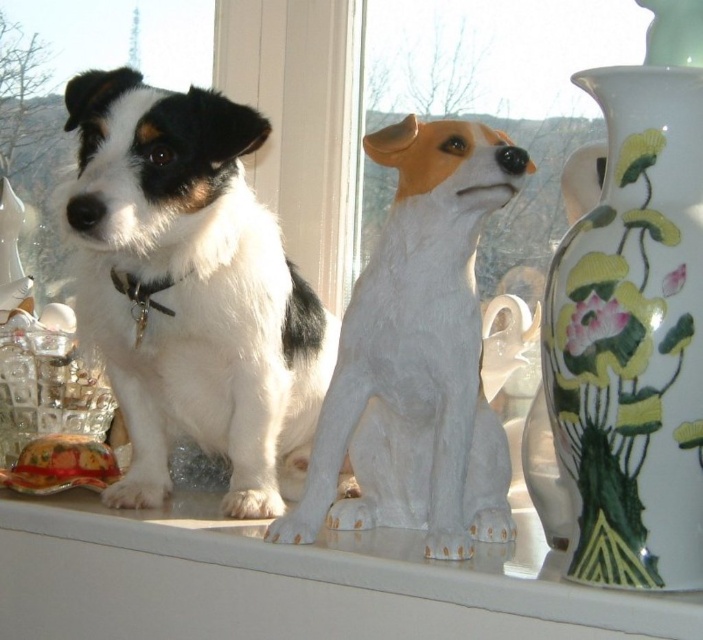
Question: Is black and white fur dog at center in front of porcelain vase with floral design at right?

Choices:
 (A) yes
 (B) no

Answer: (B)

Question: Can you confirm if black and white fur dog at center is bigger than white glossy window sill at center?

Choices:
 (A) yes
 (B) no

Answer: (A)

Question: Among these points, which one is farthest from the camera?

Choices:
 (A) (439, 289)
 (B) (188, 305)

Answer: (B)

Question: Considering the relative positions of black and white fur dog at center and white glossy statue at center in the image provided, where is black and white fur dog at center located with respect to white glossy statue at center?

Choices:
 (A) below
 (B) above

Answer: (B)

Question: Which object is farther from the camera taking this photo?

Choices:
 (A) white glossy statue at center
 (B) black and white fur dog at center
 (C) white glossy window sill at center

Answer: (B)

Question: Which point is farther from the camera taking this photo?

Choices:
 (A) 191,330
 (B) 382,372
 (C) 560,609

Answer: (A)